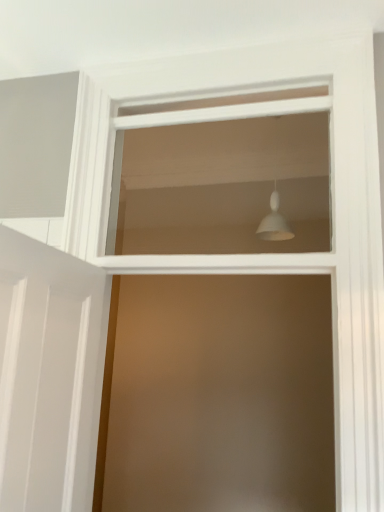
Question: From the image's perspective, is white matte light fixture at upper center positioned above or below white matte lampshade at upper center?

Choices:
 (A) below
 (B) above

Answer: (B)

Question: Considering the positions of white matte light fixture at upper center and white matte lampshade at upper center in the image, is white matte light fixture at upper center bigger or smaller than white matte lampshade at upper center?

Choices:
 (A) small
 (B) big

Answer: (A)

Question: Looking at their shapes, would you say white matte light fixture at upper center is wider or thinner than white matte lampshade at upper center?

Choices:
 (A) thin
 (B) wide

Answer: (B)

Question: Based on their sizes in the image, would you say white matte lampshade at upper center is bigger or smaller than white matte light fixture at upper center?

Choices:
 (A) small
 (B) big

Answer: (B)

Question: Considering the positions of white matte lampshade at upper center and white matte light fixture at upper center in the image, is white matte lampshade at upper center taller or shorter than white matte light fixture at upper center?

Choices:
 (A) short
 (B) tall

Answer: (B)

Question: Visually, is white matte lampshade at upper center positioned to the left or to the right of white matte light fixture at upper center?

Choices:
 (A) right
 (B) left

Answer: (B)

Question: From the image's perspective, is white matte lampshade at upper center located above or below white matte light fixture at upper center?

Choices:
 (A) above
 (B) below

Answer: (B)